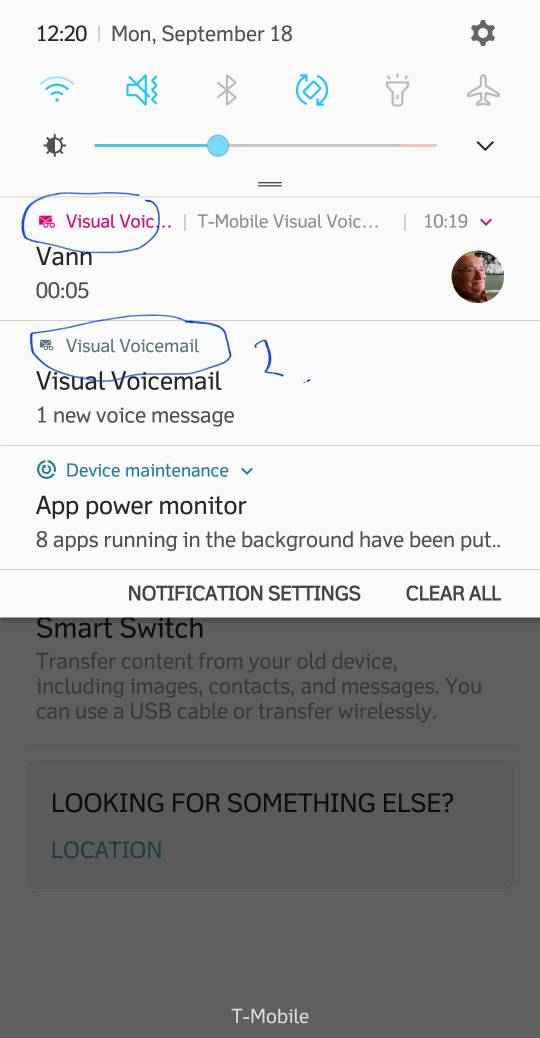
Where is `phone brightness slider`? The height and width of the screenshot is (1038, 540). phone brightness slider is located at coordinates (99, 145).